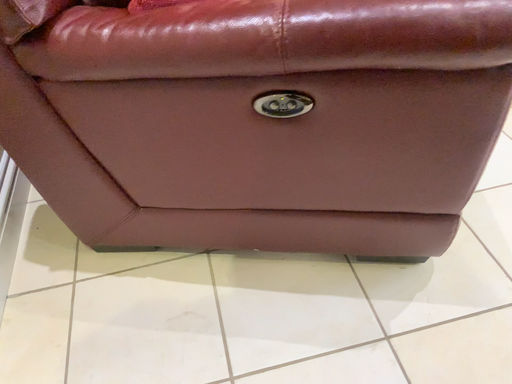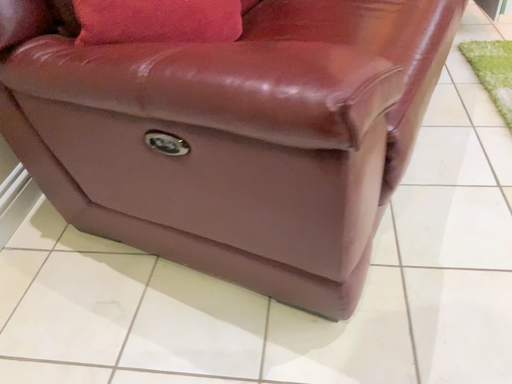
Question: How did the camera likely rotate when shooting the video?

Choices:
 (A) rotated right
 (B) rotated left

Answer: (B)